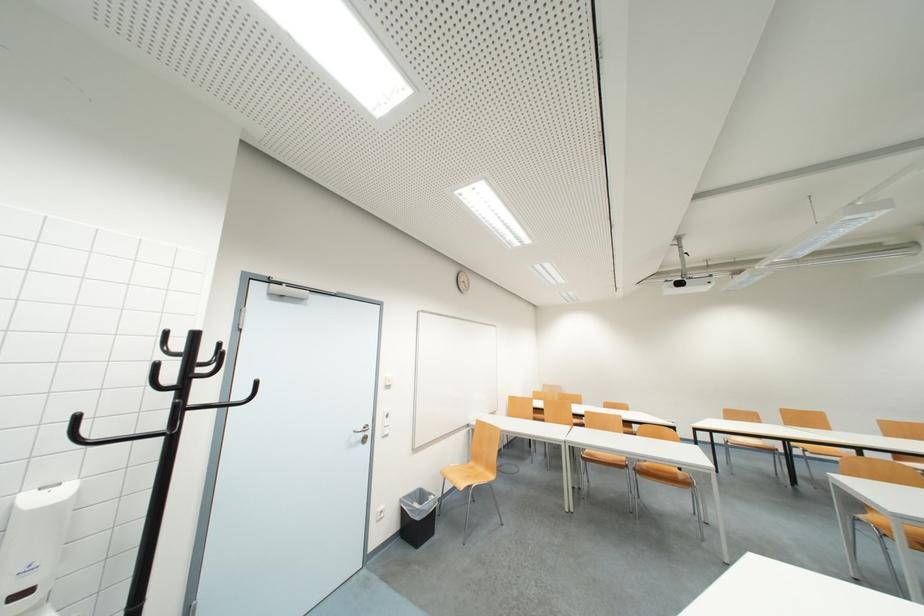
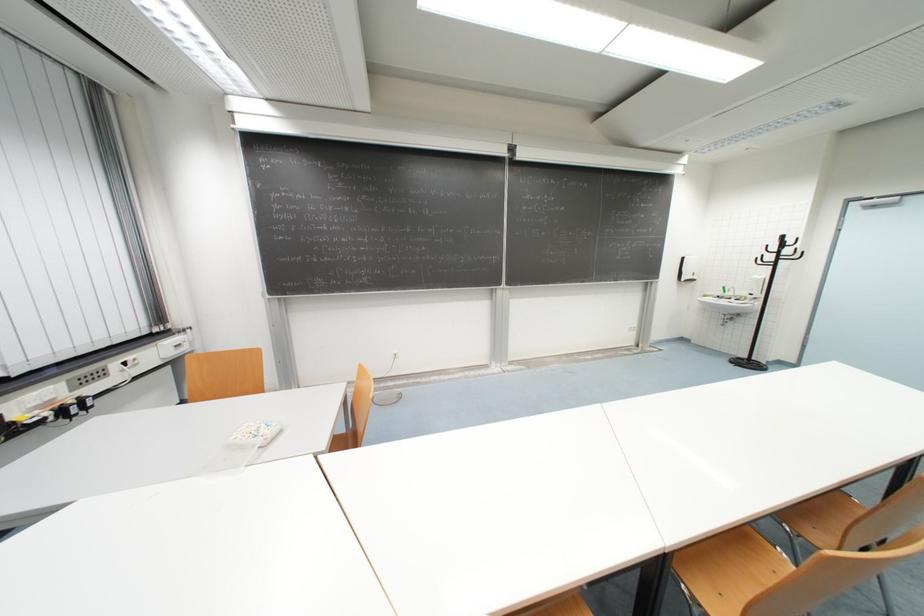
Where in the second image is the point corresponding to [195,367] from the first image?

(785, 246)